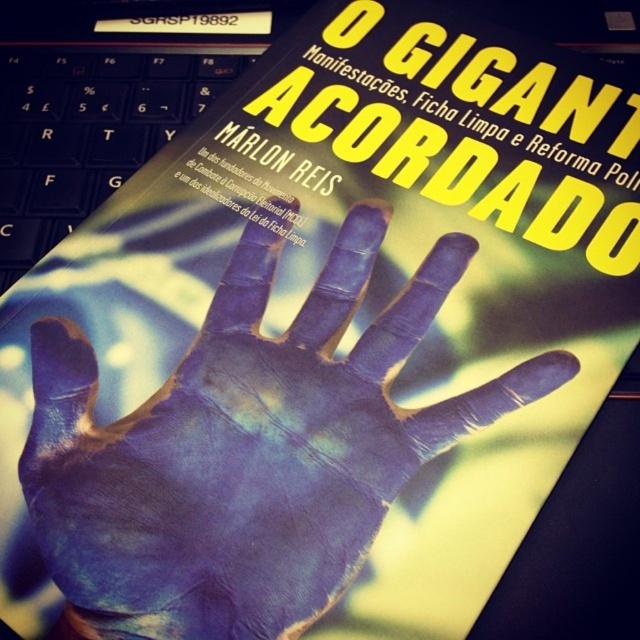
You are a graphic designer working on a layout for a book cover. You have two points marked on your design, point (140, 464) and point (86, 186). If you need to place a new element between these two points so that it appears closer to the viewer than the back point but not overlapping with either, where should you position it?

You should position the new element between the two points, closer to point (140, 464) since it is in front of point (86, 186). This ensures the element stays in the foreground without overlapping either point.

You are a graphic designer working on a book cover. You need to place a blue painted hand at center and a black plastic keyboard at upper left. Based on the scene description, where should the blue painted hand be placed relative to the black plastic keyboard?

The blue painted hand at center should be placed on the right side of the black plastic keyboard at upper left.